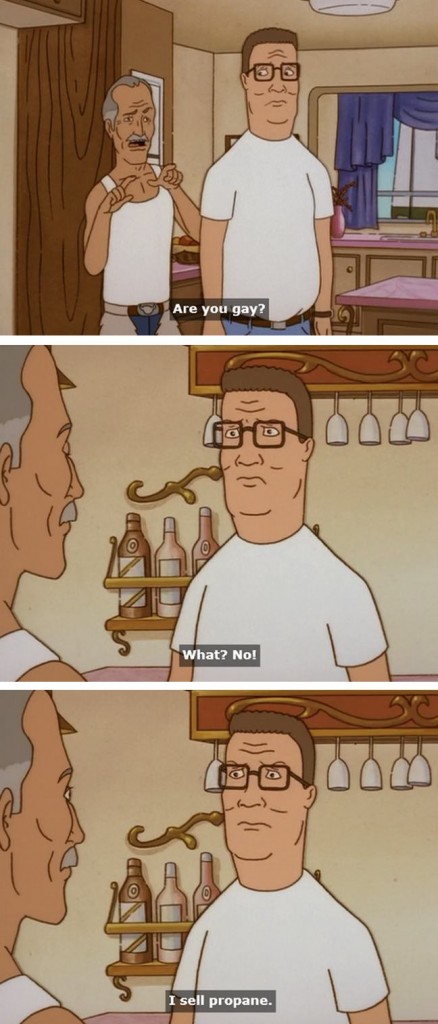
Identify the location of wall. This screenshot has height=1024, width=438. (369, 850).